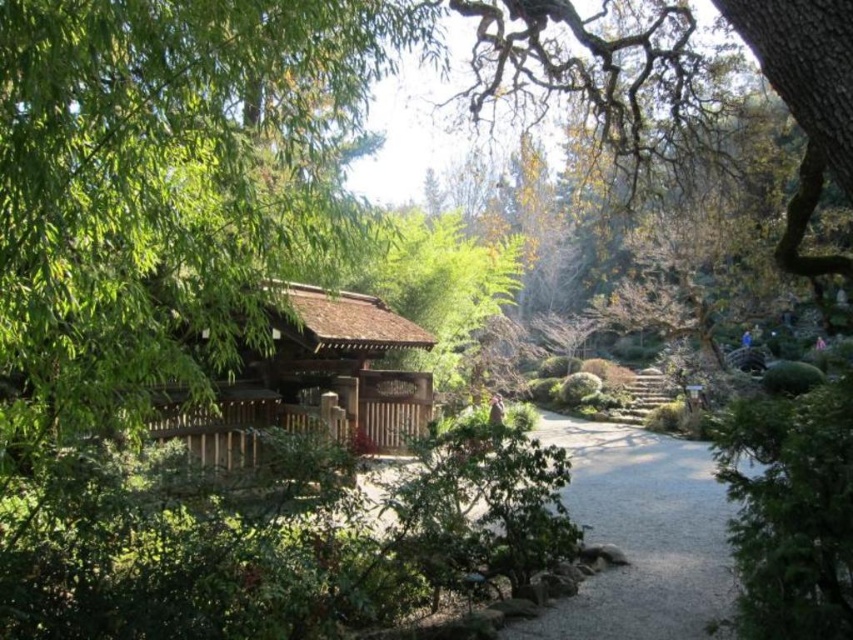
Question: Can you confirm if gray gravel path at center is positioned to the right of brown wooden gazebo at center?

Choices:
 (A) yes
 (B) no

Answer: (A)

Question: Estimate the real-world distances between objects in this image. Which object is closer to the brown wooden gazebo at center?

Choices:
 (A) gray gravel path at center
 (B) green leafy tree at left

Answer: (B)

Question: Can you confirm if gray gravel path at center is thinner than brown wooden gazebo at center?

Choices:
 (A) no
 (B) yes

Answer: (A)

Question: Estimate the real-world distances between objects in this image. Which object is closer to the gray gravel path at center?

Choices:
 (A) brown wooden gazebo at center
 (B) green leafy tree at left

Answer: (B)

Question: Is the position of green leafy tree at left less distant than that of gray gravel path at center?

Choices:
 (A) no
 (B) yes

Answer: (B)

Question: Estimate the real-world distances between objects in this image. Which object is closer to the brown wooden gazebo at center?

Choices:
 (A) gray gravel path at center
 (B) green leafy tree at left

Answer: (B)